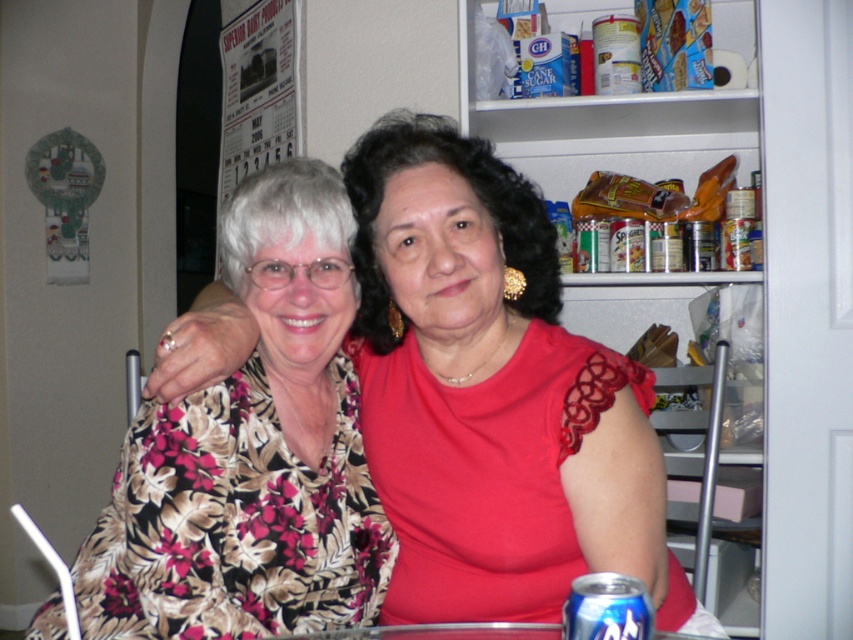
You are standing in the kitchen and want to grab the blue metallic can at lower center from the pantry. However, there is a floral fabric blouse at center in your way. Can you reach the can without moving the blouse?

The floral fabric blouse at center is further to the viewer than blue metallic can at lower center, so the blouse is closer to you. Therefore, you would need to move the blouse to access the can.